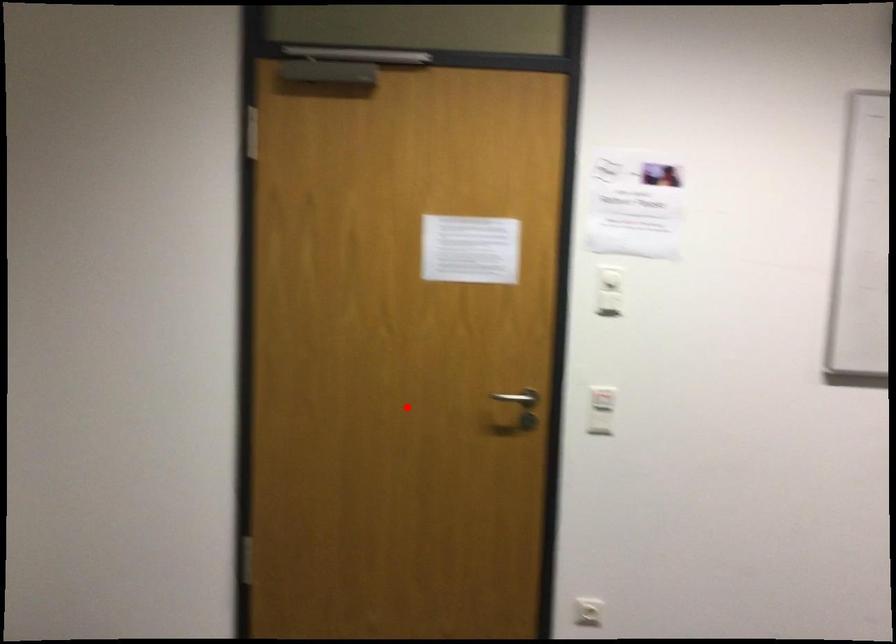
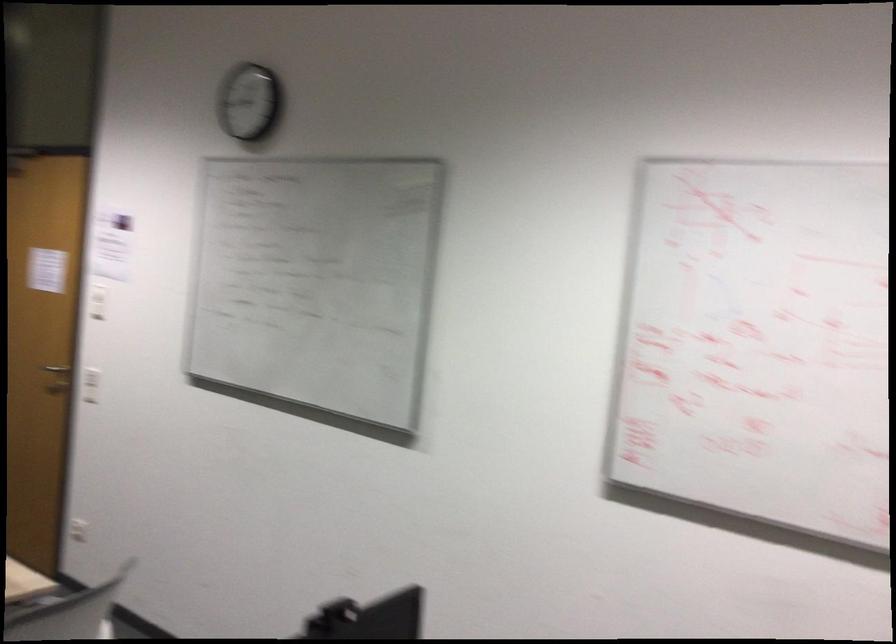
Question: I am providing you with two images of the same scene from different viewpoints. Image1 has a red point marked. In image2, the corresponding 3D location appears at what relative position? Reply with the corresponding letter.

Choices:
 (A) Closer
 (B) Farther

Answer: (B)